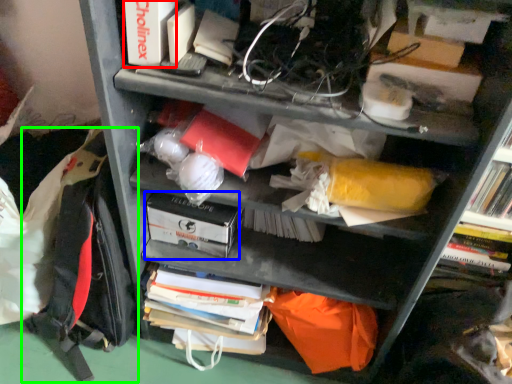
Question: Which object is positioned farthest from paperback book (highlighted by a red box)? Select from paperback book (highlighted by a blue box) and backpack (highlighted by a green box).

Choices:
 (A) paperback book
 (B) backpack

Answer: (B)